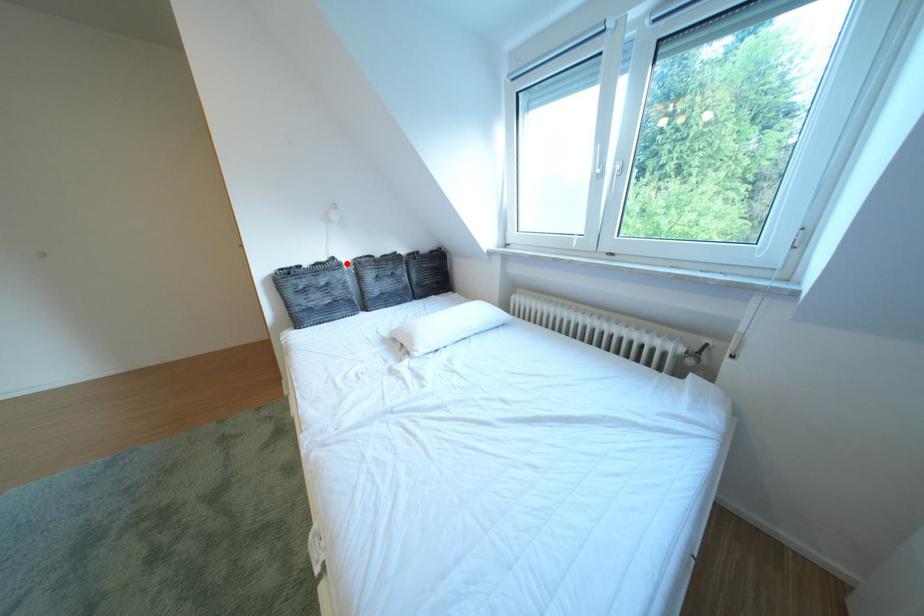
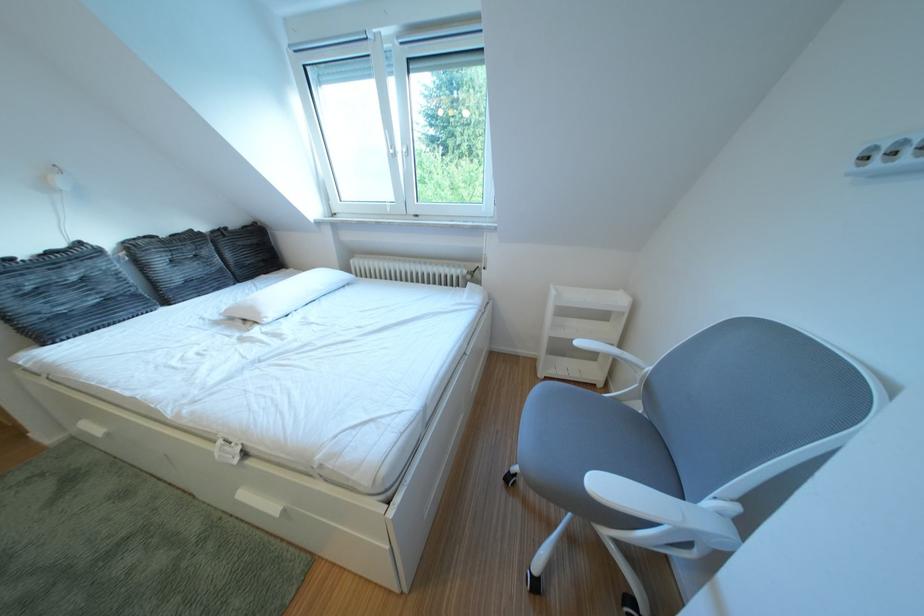
Question: I am providing you with two images of the same scene from different viewpoints. Given a red point in image1, look at the same physical point in image2. Is it:

Choices:
 (A) Closer to the viewpoint
 (B) Farther from the viewpoint

Answer: (B)